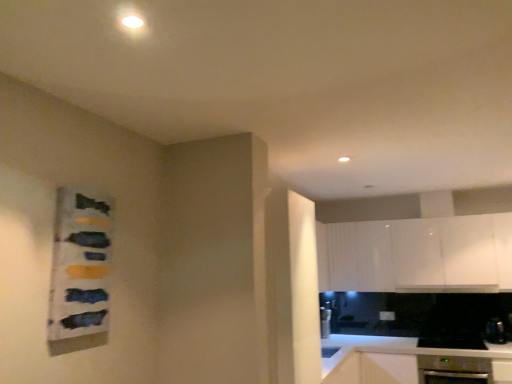
Image resolution: width=512 pixels, height=384 pixels. Describe the element at coordinates (495, 331) in the screenshot. I see `satin black oven at lower right, which ranks as the second appliance in left-to-right order` at that location.

Describe the element at coordinates (452, 343) in the screenshot. Image resolution: width=512 pixels, height=384 pixels. I see `black stainless steel oven at lower right, which is the 2th appliance in right-to-left order` at that location.

What are the coordinates of `satin silver dishwasher at lower right` in the screenshot? It's located at (454, 370).

Identify the location of satin black oven at lower right, which ranks as the second appliance in left-to-right order. Image resolution: width=512 pixels, height=384 pixels. (495, 331).

Is white glossy countertop at lower right facing towards satin black oven at lower right, which ranks as the second appliance in left-to-right order?

No, white glossy countertop at lower right is not turned towards satin black oven at lower right, which ranks as the second appliance in left-to-right order.

From the image's perspective, relative to satin black oven at lower right, which ranks as the second appliance in left-to-right order, is white glossy countertop at lower right above or below?

Clearly, from the image's perspective, white glossy countertop at lower right is below satin black oven at lower right, which ranks as the second appliance in left-to-right order.

Which object is thinner, white glossy countertop at lower right or satin black oven at lower right, the 1th appliance in the right-to-left sequence?

Thinner between the two is satin black oven at lower right, the 1th appliance in the right-to-left sequence.

In terms of height, does white glossy countertop at lower right look taller or shorter compared to satin black oven at lower right, the 1th appliance in the right-to-left sequence?

Considering their sizes, white glossy countertop at lower right has more height than satin black oven at lower right, the 1th appliance in the right-to-left sequence.

Could you tell me if satin black oven at lower right, which ranks as the second appliance in left-to-right order, is turned towards satin silver dishwasher at lower right?

No, satin black oven at lower right, which ranks as the second appliance in left-to-right order, does not turn towards satin silver dishwasher at lower right.

The image size is (512, 384). I want to click on appliance that is the 2nd object located behind the satin silver dishwasher at lower right, so click(495, 331).

Which is in front, point (503, 342) or point (431, 370)?

Positioned in front is point (431, 370).

Based on the photo, is white glossy cabinet at upper right to the right of satin black oven at lower right, which ranks as the second appliance in left-to-right order, from the viewer's perspective?

No.

Between white glossy cabinet at upper right and satin black oven at lower right, the 1th appliance in the right-to-left sequence, which one has smaller size?

satin black oven at lower right, the 1th appliance in the right-to-left sequence, is smaller.

Does white glossy cabinet at upper right lie in front of satin black oven at lower right, which ranks as the second appliance in left-to-right order?

Yes, white glossy cabinet at upper right is in front of satin black oven at lower right, which ranks as the second appliance in left-to-right order.

From a real-world perspective, is white glossy cabinet at upper right positioned under satin silver dishwasher at lower right based on gravity?

No, from a real-world perspective, white glossy cabinet at upper right is not under satin silver dishwasher at lower right.

Visually, is white glossy cabinet at upper right positioned to the left or to the right of satin silver dishwasher at lower right?

white glossy cabinet at upper right is to the left of satin silver dishwasher at lower right.

In the image, is white glossy cabinet at upper right positioned in front of or behind satin silver dishwasher at lower right?

In the image, white glossy cabinet at upper right appears behind satin silver dishwasher at lower right.

Is black stainless steel oven at lower right, which is the 2th appliance in right-to-left order, spatially inside white glossy cabinet at upper right, or outside of it?

black stainless steel oven at lower right, which is the 2th appliance in right-to-left order, is spatially situated outside white glossy cabinet at upper right.

Consider the image. Can you confirm if black stainless steel oven at lower right, which ranks as the 1th appliance in left-to-right order, is thinner than white glossy cabinet at upper right?

No.

Locate an element on the screen. Image resolution: width=512 pixels, height=384 pixels. cabinetry above the black stainless steel oven at lower right, which is the 2th appliance in right-to-left order (from a real-world perspective) is located at coordinates (417, 255).

Visually, is black stainless steel oven at lower right, which is the 2th appliance in right-to-left order, positioned to the left or to the right of white glossy cabinet at upper right?

black stainless steel oven at lower right, which is the 2th appliance in right-to-left order, is positioned on white glossy cabinet at upper right's right side.

Locate an element on the screen. The width and height of the screenshot is (512, 384). cabinetry that appears above the satin silver dishwasher at lower right (from a real-world perspective) is located at coordinates (417, 255).

From the image's perspective, does satin silver dishwasher at lower right appear lower than white glossy cabinet at upper right?

Indeed, from the image's perspective, satin silver dishwasher at lower right is shown beneath white glossy cabinet at upper right.

Considering the relative positions of satin silver dishwasher at lower right and white glossy cabinet at upper right in the image provided, is satin silver dishwasher at lower right to the left or to the right of white glossy cabinet at upper right?

Clearly, satin silver dishwasher at lower right is on the right of white glossy cabinet at upper right in the image.

Does satin silver dishwasher at lower right have a larger size compared to white glossy cabinet at upper right?

Actually, satin silver dishwasher at lower right might be smaller than white glossy cabinet at upper right.

Find the location of `appliance that is the 1st one when counting rightward from the white glossy countertop at lower right`. appliance that is the 1st one when counting rightward from the white glossy countertop at lower right is located at coordinates (452, 343).

Who is taller, white glossy countertop at lower right or black stainless steel oven at lower right, which ranks as the 1th appliance in left-to-right order?

white glossy countertop at lower right is taller.

Between white glossy countertop at lower right and black stainless steel oven at lower right, which ranks as the 1th appliance in left-to-right order, which one is positioned behind?

black stainless steel oven at lower right, which ranks as the 1th appliance in left-to-right order.

Where is `countertop in front of the satin black oven at lower right, which ranks as the second appliance in left-to-right order`? The width and height of the screenshot is (512, 384). countertop in front of the satin black oven at lower right, which ranks as the second appliance in left-to-right order is located at coordinates (405, 360).

From a real-world perspective, starting from the satin silver dishwasher at lower right, which appliance is the 2nd one vertically above it? Please provide its 2D coordinates.

[(495, 331)]

Considering their positions, is satin black oven at lower right, the 1th appliance in the right-to-left sequence, positioned closer to white glossy cabinet at upper right than black stainless steel oven at lower right, which is the 2th appliance in right-to-left order?

The object closer to white glossy cabinet at upper right is black stainless steel oven at lower right, which is the 2th appliance in right-to-left order.

Based on their spatial positions, is white glossy cabinet at upper right or satin silver dishwasher at lower right further from white glossy countertop at lower right?

The object further to white glossy countertop at lower right is white glossy cabinet at upper right.

From the image, which object appears to be nearer to white glossy cabinet at upper right, white glossy countertop at lower right or black stainless steel oven at lower right, which ranks as the 1th appliance in left-to-right order?

white glossy countertop at lower right is positioned closer to the anchor white glossy cabinet at upper right.

Estimate the real-world distances between objects in this image. Which object is closer to satin silver dishwasher at lower right, satin black oven at lower right, the 1th appliance in the right-to-left sequence, or white glossy cabinet at upper right?

Based on the image, satin black oven at lower right, the 1th appliance in the right-to-left sequence, appears to be nearer to satin silver dishwasher at lower right.

Which object lies further to the anchor point white glossy cabinet at upper right, satin silver dishwasher at lower right or satin black oven at lower right, the 1th appliance in the right-to-left sequence?

satin black oven at lower right, the 1th appliance in the right-to-left sequence, is further to white glossy cabinet at upper right.

From the picture: Looking at the image, which one is located closer to white glossy countertop at lower right, satin silver dishwasher at lower right or white glossy cabinet at upper right?

Based on the image, satin silver dishwasher at lower right appears to be nearer to white glossy countertop at lower right.

From the picture: Looking at the image, which one is located closer to white glossy countertop at lower right, satin black oven at lower right, the 1th appliance in the right-to-left sequence, or satin silver dishwasher at lower right?

The object closer to white glossy countertop at lower right is satin silver dishwasher at lower right.

Looking at the image, which one is located further to white glossy cabinet at upper right, white glossy countertop at lower right or satin silver dishwasher at lower right?

satin silver dishwasher at lower right lies further to white glossy cabinet at upper right than the other object.

At what (x,y) coordinates should I click in order to perform the action: click on appliance located between satin silver dishwasher at lower right and satin black oven at lower right, the 1th appliance in the right-to-left sequence, in the left-right direction. Please return your answer as a coordinate pair (x, y). Looking at the image, I should click on (452, 343).

Identify the location of dish washer between black stainless steel oven at lower right, which is the 2th appliance in right-to-left order, and white glossy countertop at lower right from top to bottom. The width and height of the screenshot is (512, 384). coord(454,370).

In order to click on appliance between white glossy cabinet at upper right and black stainless steel oven at lower right, which ranks as the 1th appliance in left-to-right order, vertically in this screenshot , I will do `click(495, 331)`.

What are the coordinates of `appliance situated between white glossy countertop at lower right and satin black oven at lower right, the 1th appliance in the right-to-left sequence, from left to right` in the screenshot? It's located at (452, 343).